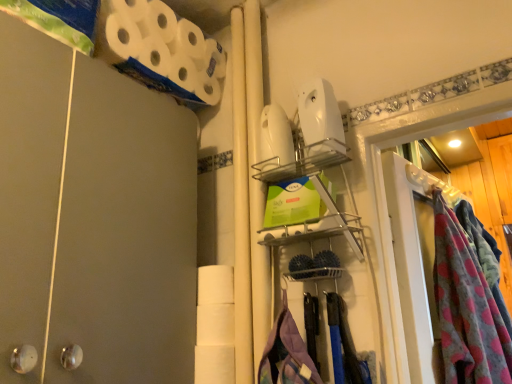
Locate an element on the screen. The height and width of the screenshot is (384, 512). matte gray barn door at left is located at coordinates (93, 218).

The image size is (512, 384). Describe the element at coordinates (407, 264) in the screenshot. I see `clear plastic glass door at right` at that location.

What are the coordinates of `white matte toilet paper at center, the second toilet paper when ordered from top to bottom` in the screenshot? It's located at click(215, 325).

Where is `matte gray barn door at left`? The image size is (512, 384). matte gray barn door at left is located at coordinates (93, 218).

Is clear plastic glass door at right positioned beyond the bounds of white matte toilet paper at upper left, marked as the 1th toilet paper in a top-to-bottom arrangement?

Yes, clear plastic glass door at right is located beyond the bounds of white matte toilet paper at upper left, marked as the 1th toilet paper in a top-to-bottom arrangement.

In the scene shown: From the image's perspective, which is above, clear plastic glass door at right or white matte toilet paper at upper left, marked as the 1th toilet paper in a top-to-bottom arrangement?

white matte toilet paper at upper left, marked as the 1th toilet paper in a top-to-bottom arrangement.

Is clear plastic glass door at right looking in the opposite direction of white matte toilet paper at upper left, placed as the 2th toilet paper when sorted from bottom to top?

That's not correct — clear plastic glass door at right is not looking away from white matte toilet paper at upper left, placed as the 2th toilet paper when sorted from bottom to top.

Are clear plastic glass door at right and matte gray barn door at left far apart?

No, clear plastic glass door at right is not far from matte gray barn door at left.

Based on the photo, who is taller, clear plastic glass door at right or matte gray barn door at left?

matte gray barn door at left.

Is clear plastic glass door at right not within matte gray barn door at left?

Indeed, clear plastic glass door at right is completely outside matte gray barn door at left.

From a real-world perspective, is clear plastic glass door at right positioned under matte gray barn door at left based on gravity?

Yes.

Is white matte toilet paper at center, the second toilet paper when ordered from top to bottom, not near fluffy pink blanket at right?

They are positioned close to each other.

Considering the sizes of objects white matte toilet paper at center, the second toilet paper when ordered from top to bottom, and fluffy pink blanket at right in the image provided, who is taller, white matte toilet paper at center, the second toilet paper when ordered from top to bottom, or fluffy pink blanket at right?

fluffy pink blanket at right is taller.

Would you say white matte toilet paper at center, the second toilet paper when ordered from top to bottom, is inside or outside fluffy pink blanket at right?

white matte toilet paper at center, the second toilet paper when ordered from top to bottom, is not enclosed by fluffy pink blanket at right.

Could you tell me if white matte toilet paper at center, marked as the 1th toilet paper in a bottom-to-top arrangement, is turned towards fluffy pink blanket at right?

No, white matte toilet paper at center, marked as the 1th toilet paper in a bottom-to-top arrangement, is not aimed at fluffy pink blanket at right.

Considering the positions of objects clear plastic glass door at right and white matte toilet paper at center, the second toilet paper when ordered from top to bottom, in the image provided, who is more to the right, clear plastic glass door at right or white matte toilet paper at center, the second toilet paper when ordered from top to bottom,?

Positioned to the right is clear plastic glass door at right.

Is clear plastic glass door at right facing away from white matte toilet paper at center, marked as the 1th toilet paper in a bottom-to-top arrangement?

Answer: No, clear plastic glass door at right is not facing away from white matte toilet paper at center, marked as the 1th toilet paper in a bottom-to-top arrangement.

Is clear plastic glass door at right next to white matte toilet paper at center, marked as the 1th toilet paper in a bottom-to-top arrangement, and touching it?

No, clear plastic glass door at right is not in contact with white matte toilet paper at center, marked as the 1th toilet paper in a bottom-to-top arrangement.

Is clear plastic glass door at right inside or outside of white matte toilet paper at center, the second toilet paper when ordered from top to bottom?

clear plastic glass door at right cannot be found inside white matte toilet paper at center, the second toilet paper when ordered from top to bottom.

Does white matte toilet paper at center, marked as the 1th toilet paper in a bottom-to-top arrangement, turn towards clear plastic glass door at right?

No, white matte toilet paper at center, marked as the 1th toilet paper in a bottom-to-top arrangement, is not oriented towards clear plastic glass door at right.

Which of these two, white matte toilet paper at center, the second toilet paper when ordered from top to bottom, or clear plastic glass door at right, is smaller?

white matte toilet paper at center, the second toilet paper when ordered from top to bottom, is smaller.

Considering the relative sizes of white matte toilet paper at center, marked as the 1th toilet paper in a bottom-to-top arrangement, and clear plastic glass door at right in the image provided, is white matte toilet paper at center, marked as the 1th toilet paper in a bottom-to-top arrangement, thinner than clear plastic glass door at right?

In fact, white matte toilet paper at center, marked as the 1th toilet paper in a bottom-to-top arrangement, might be wider than clear plastic glass door at right.

Is clear plastic glass door at right located within white matte toilet paper at center, the second toilet paper when ordered from top to bottom?

No, clear plastic glass door at right is not a part of white matte toilet paper at center, the second toilet paper when ordered from top to bottom.

Considering the relative sizes of matte gray barn door at left and white matte toilet paper at center, the second toilet paper when ordered from top to bottom, in the image provided, is matte gray barn door at left wider than white matte toilet paper at center, the second toilet paper when ordered from top to bottom,?

Correct, the width of matte gray barn door at left exceeds that of white matte toilet paper at center, the second toilet paper when ordered from top to bottom.

Considering their positions, is matte gray barn door at left located in front of or behind white matte toilet paper at center, the second toilet paper when ordered from top to bottom?

Clearly, matte gray barn door at left is in front of white matte toilet paper at center, the second toilet paper when ordered from top to bottom.

The height and width of the screenshot is (384, 512). In order to click on barn door above the white matte toilet paper at center, marked as the 1th toilet paper in a bottom-to-top arrangement (from a real-world perspective) in this screenshot , I will do `click(93, 218)`.

Consider the image. Is matte gray barn door at left facing away from white matte toilet paper at center, marked as the 1th toilet paper in a bottom-to-top arrangement?

No, white matte toilet paper at center, marked as the 1th toilet paper in a bottom-to-top arrangement, is not at the back of matte gray barn door at left.

At what (x,y) coordinates should I click in order to perform the action: click on clothing below the white matte toilet paper at upper left, placed as the 2th toilet paper when sorted from bottom to top (from a real-world perspective). Please return your answer as a coordinate pair (x, y). The image size is (512, 384). Looking at the image, I should click on (466, 308).

Is fluffy pink blanket at right smaller than white matte toilet paper at upper left, marked as the 1th toilet paper in a top-to-bottom arrangement?

Actually, fluffy pink blanket at right might be larger than white matte toilet paper at upper left, marked as the 1th toilet paper in a top-to-bottom arrangement.

Considering the relative sizes of fluffy pink blanket at right and white matte toilet paper at upper left, marked as the 1th toilet paper in a top-to-bottom arrangement, in the image provided, is fluffy pink blanket at right shorter than white matte toilet paper at upper left, marked as the 1th toilet paper in a top-to-bottom arrangement,?

Incorrect, the height of fluffy pink blanket at right does not fall short of that of white matte toilet paper at upper left, marked as the 1th toilet paper in a top-to-bottom arrangement.

The image size is (512, 384). I want to click on glass door on the right side of white matte toilet paper at upper left, marked as the 1th toilet paper in a top-to-bottom arrangement, so click(x=407, y=264).

At what (x,y) coordinates should I click in order to perform the action: click on barn door above the clear plastic glass door at right (from a real-world perspective). Please return your answer as a coordinate pair (x, y). This screenshot has width=512, height=384. Looking at the image, I should click on (93, 218).

Based on their spatial positions, is clear plastic glass door at right or white matte toilet paper at center, marked as the 1th toilet paper in a bottom-to-top arrangement, further from matte gray barn door at left?

The object further to matte gray barn door at left is clear plastic glass door at right.

Looking at the image, which one is located closer to white matte toilet paper at center, marked as the 1th toilet paper in a bottom-to-top arrangement, matte gray barn door at left or fluffy pink blanket at right?

matte gray barn door at left is positioned closer to the anchor white matte toilet paper at center, marked as the 1th toilet paper in a bottom-to-top arrangement.

From the image, which object appears to be nearer to white matte toilet paper at center, the second toilet paper when ordered from top to bottom, clear plastic glass door at right or white matte toilet paper at upper left, placed as the 2th toilet paper when sorted from bottom to top?

clear plastic glass door at right is positioned closer to the anchor white matte toilet paper at center, the second toilet paper when ordered from top to bottom.

Looking at the image, which one is located further to clear plastic glass door at right, white matte toilet paper at center, marked as the 1th toilet paper in a bottom-to-top arrangement, or white matte toilet paper at upper left, placed as the 2th toilet paper when sorted from bottom to top?

Among the two, white matte toilet paper at upper left, placed as the 2th toilet paper when sorted from bottom to top, is located further to clear plastic glass door at right.

When comparing their distances from white matte toilet paper at upper left, marked as the 1th toilet paper in a top-to-bottom arrangement, does white matte toilet paper at center, marked as the 1th toilet paper in a bottom-to-top arrangement, or fluffy pink blanket at right seem closer?

Among the two, white matte toilet paper at center, marked as the 1th toilet paper in a bottom-to-top arrangement, is located nearer to white matte toilet paper at upper left, marked as the 1th toilet paper in a top-to-bottom arrangement.

When comparing their distances from white matte toilet paper at upper left, marked as the 1th toilet paper in a top-to-bottom arrangement, does matte gray barn door at left or clear plastic glass door at right seem further?

Based on the image, clear plastic glass door at right appears to be further to white matte toilet paper at upper left, marked as the 1th toilet paper in a top-to-bottom arrangement.

When comparing their distances from fluffy pink blanket at right, does white matte toilet paper at center, marked as the 1th toilet paper in a bottom-to-top arrangement, or clear plastic glass door at right seem closer?

Based on the image, clear plastic glass door at right appears to be nearer to fluffy pink blanket at right.

Based on their spatial positions, is fluffy pink blanket at right or matte gray barn door at left closer to clear plastic glass door at right?

The object closer to clear plastic glass door at right is fluffy pink blanket at right.

Locate an element on the screen. Image resolution: width=512 pixels, height=384 pixels. glass door located between white matte toilet paper at upper left, placed as the 2th toilet paper when sorted from bottom to top, and fluffy pink blanket at right in the left-right direction is located at coordinates (407, 264).

The image size is (512, 384). Find the location of `glass door located between white matte toilet paper at center, the second toilet paper when ordered from top to bottom, and fluffy pink blanket at right in the left-right direction`. glass door located between white matte toilet paper at center, the second toilet paper when ordered from top to bottom, and fluffy pink blanket at right in the left-right direction is located at coordinates (407, 264).

The image size is (512, 384). What are the coordinates of `toilet paper between white matte toilet paper at upper left, marked as the 1th toilet paper in a top-to-bottom arrangement, and fluffy pink blanket at right from left to right` in the screenshot? It's located at (215, 325).

What are the coordinates of `glass door between matte gray barn door at left and fluffy pink blanket at right in the horizontal direction` in the screenshot? It's located at (407, 264).